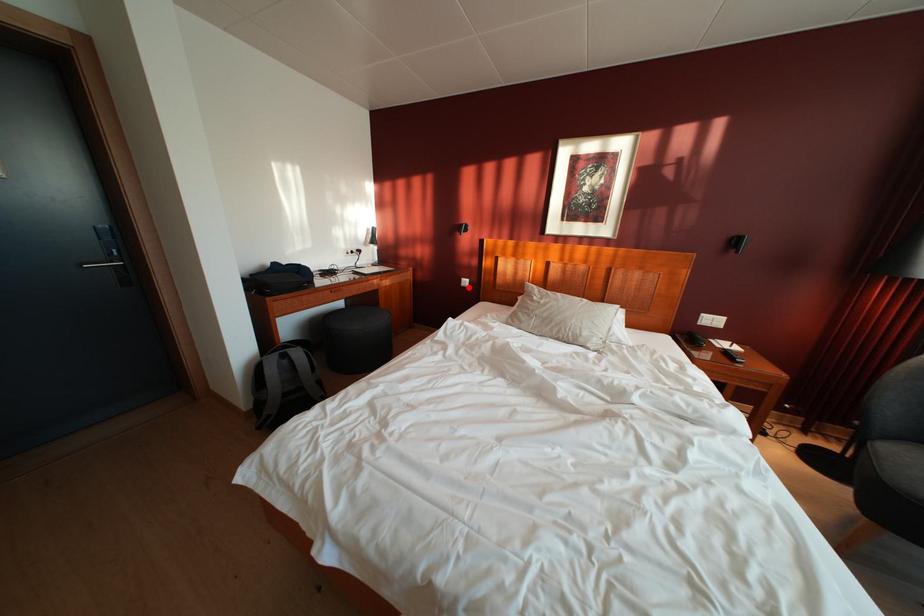
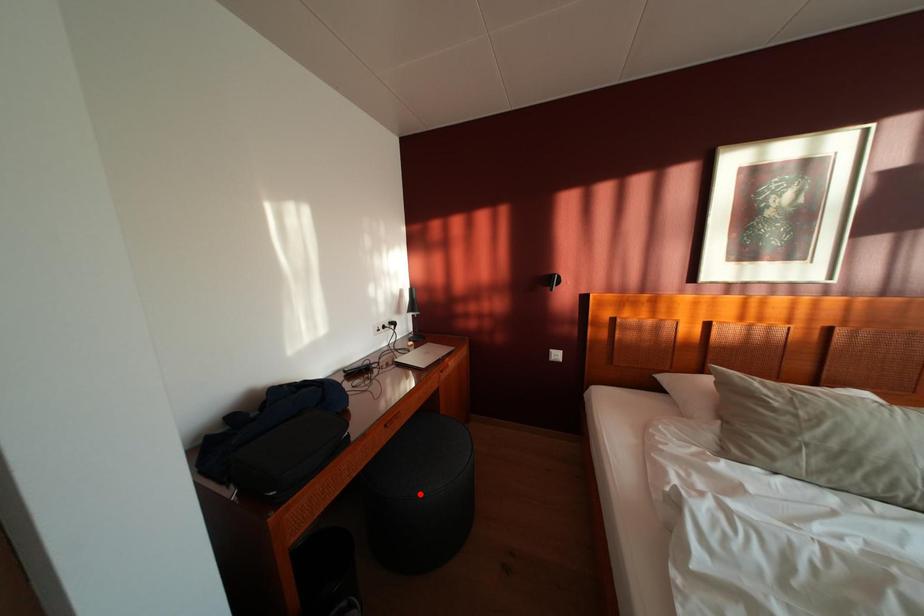
I am providing you with two images of the same scene from different viewpoints. A red point is marked on the first image and another point is marked on the second image. Does the point marked in image1 correspond to the same location as the one in image2?

No